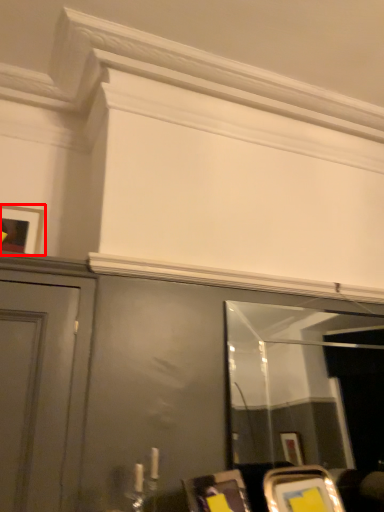
Question: Where is picture frame (annotated by the red box) located in relation to mirror in the image?

Choices:
 (A) left
 (B) right

Answer: (A)